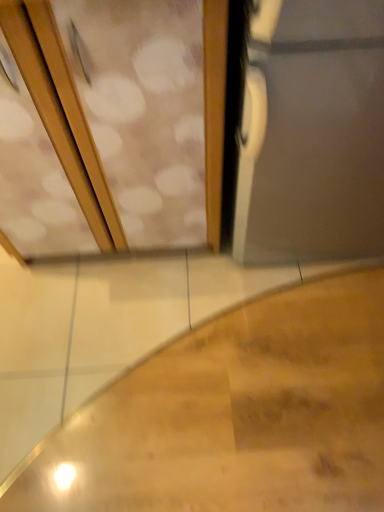
Question: From a real-world perspective, relative to wooden screen door at upper left, is wooden stairs at lower left vertically above or below?

Choices:
 (A) below
 (B) above

Answer: (A)

Question: Based on their sizes in the image, would you say wooden stairs at lower left is bigger or smaller than wooden screen door at upper left?

Choices:
 (A) small
 (B) big

Answer: (A)

Question: From the image's perspective, is wooden stairs at lower left located above or below wooden screen door at upper left?

Choices:
 (A) above
 (B) below

Answer: (B)

Question: In terms of width, does wooden screen door at upper left look wider or thinner when compared to wooden stairs at lower left?

Choices:
 (A) wide
 (B) thin

Answer: (B)

Question: Relative to wooden stairs at lower left, is wooden screen door at upper left in front or behind?

Choices:
 (A) behind
 (B) front

Answer: (B)

Question: Is point tap(221, 51) positioned closer to the camera than point tap(158, 370)?

Choices:
 (A) farther
 (B) closer

Answer: (B)

Question: Which is correct: wooden screen door at upper left is inside wooden stairs at lower left, or outside of it?

Choices:
 (A) outside
 (B) inside

Answer: (A)